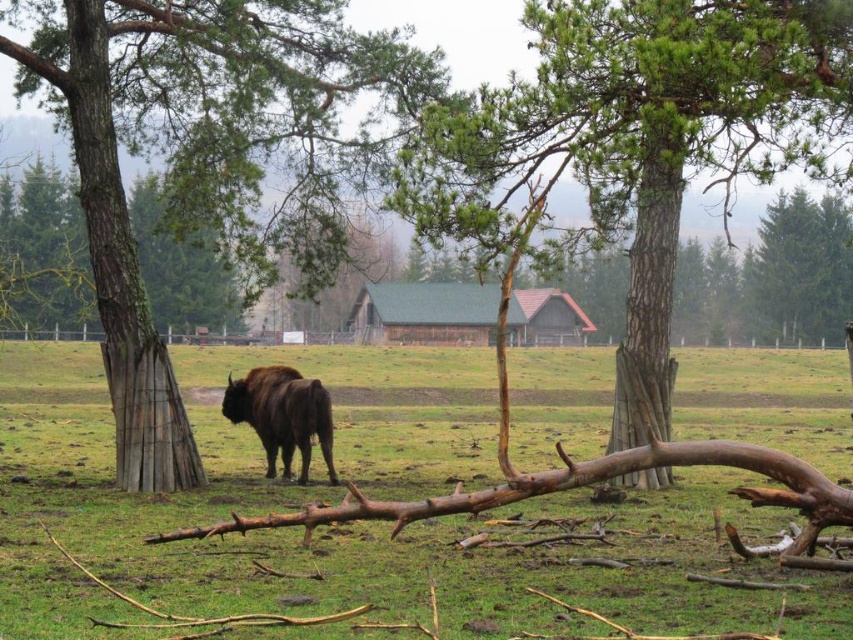
Does brown fur bison at center appear on the left side of brown furry yak at center?

Indeed, brown fur bison at center is positioned on the left side of brown furry yak at center.

Is point (721, 628) less distant than point (300, 474)?

Yes, it is in front of point (300, 474).

Who is more forward, (711, 515) or (282, 442)?

Positioned in front is point (711, 515).

Identify the location of brown fur bison at center. (360, 522).

Is brown bark tree at left closer to the viewer compared to smooth bark tree at center?

No.

Does brown bark tree at left have a lesser height compared to smooth bark tree at center?

Correct, brown bark tree at left is not as tall as smooth bark tree at center.

Does point (138, 48) come in front of point (541, 147)?

No, (138, 48) is further to viewer.

Locate an element on the screen. The width and height of the screenshot is (853, 640). brown bark tree at left is located at coordinates (209, 157).

Is smooth bark tree at center behind brown furry yak at center?

That is False.

Does smooth bark tree at center have a lesser height compared to brown furry yak at center?

In fact, smooth bark tree at center may be taller than brown furry yak at center.

This screenshot has height=640, width=853. I want to click on smooth bark tree at center, so click(x=637, y=140).